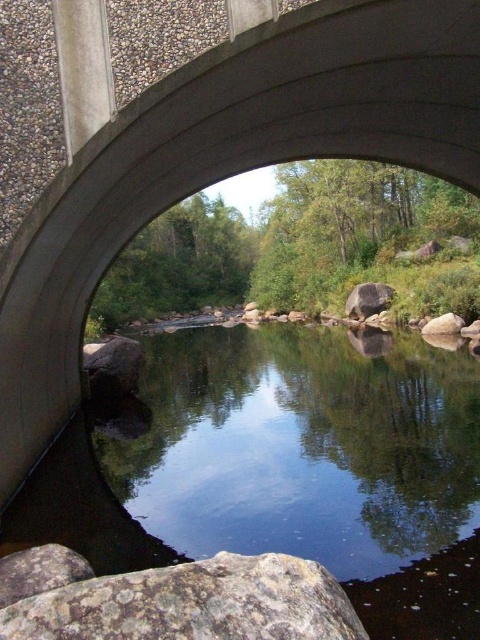
Is rusty rock at lower left bigger than rusty metallic rock at lower left?

Yes, rusty rock at lower left is bigger than rusty metallic rock at lower left.

Is rusty rock at lower left to the left of rusty metallic rock at lower left from the viewer's perspective?

Incorrect, rusty rock at lower left is not on the left side of rusty metallic rock at lower left.

Is point (244, 616) closer to viewer compared to point (1, 573)?

Yes, point (244, 616) is in front of point (1, 573).

Find the location of a particular element. Image resolution: width=480 pixels, height=640 pixels. rusty rock at lower left is located at coordinates (173, 600).

Is point (128, 353) behind point (456, 330)?

No, it is in front of (456, 330).

Measure the distance between point [122,340] and camera.

15.34 meters

At what (x,y) coordinates should I click in order to perform the action: click on gray rough rock at lower left. Please return your answer as a coordinate pair (x, y). Looking at the image, I should click on (111, 365).

Is rusty metallic rock at lower left thinner than smooth gray rock at lower right?

No.

Which is more to the left, rusty metallic rock at lower left or smooth gray rock at lower right?

Positioned to the left is rusty metallic rock at lower left.

At what (x,y) coordinates should I click in order to perform the action: click on rusty metallic rock at lower left. Please return your answer as a coordinate pair (x, y). Looking at the image, I should click on (39, 572).